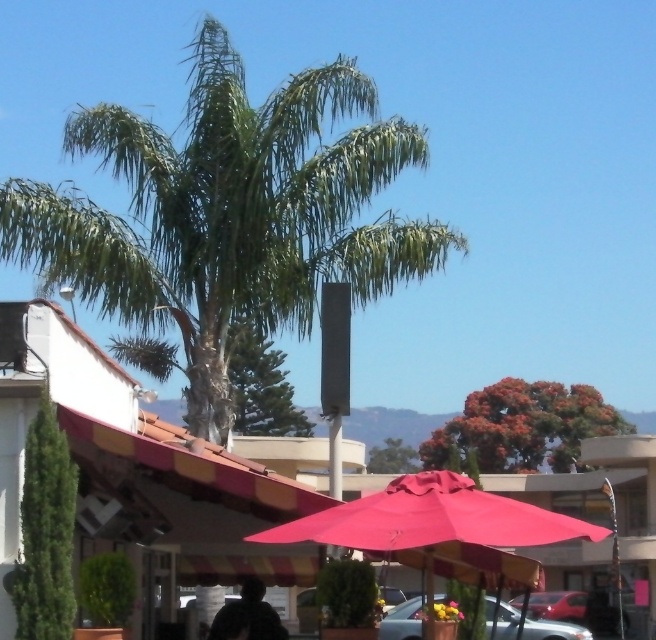
Question: Among these points, which one is farthest from the camera?

Choices:
 (A) (218, 188)
 (B) (487, 529)
 (C) (131, 499)

Answer: (A)

Question: Is matte pink umbrella at center positioned before dark fabric silhouette at lower center?

Choices:
 (A) yes
 (B) no

Answer: (A)

Question: Which object appears farthest from the camera in this image?

Choices:
 (A) matte pink umbrella at center
 (B) metallic silver car at lower center
 (C) dark fabric silhouette at lower center
 (D) striped awning at center

Answer: (D)

Question: Which point is closer to the camera?

Choices:
 (A) (411, 483)
 (B) (249, 316)
 (C) (241, 467)
 (D) (253, 604)

Answer: (A)

Question: Does matte pink umbrella at center appear on the right side of dark fabric silhouette at lower center?

Choices:
 (A) yes
 (B) no

Answer: (A)

Question: Does matte pink umbrella at center lie in front of metallic silver car at lower center?

Choices:
 (A) no
 (B) yes

Answer: (B)